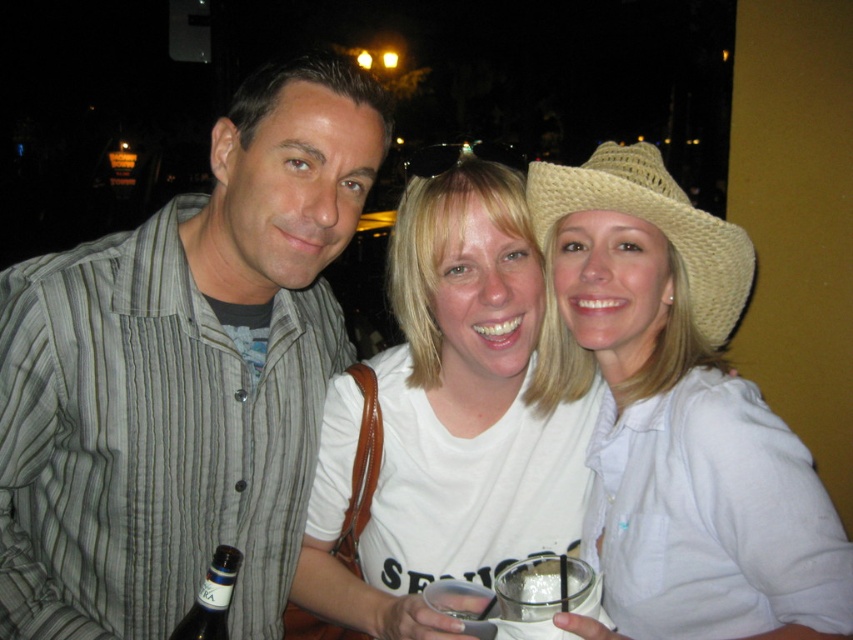
You are a photographer trying to capture a clear shot of both the white woven straw hat at upper right and the natural straw hat at center. Since the hats are different in size, which one would you need to position closer to the camera to ensure they appear the same size in the photo?

The white woven straw hat at upper right is bigger than the natural straw hat at center, so you should position the natural straw hat at center closer to the camera to make them appear the same size in the photo.

You are a photographer trying to adjust the focus of your camera. You want to ensure both the striped cotton shirt at left and the dark brown glass bottle at center are in focus. Which object should you focus on to achieve this?

You should focus on the dark brown glass bottle at center because it is behind the striped cotton shirt at left, so focusing on the farther object ensures both are in focus.